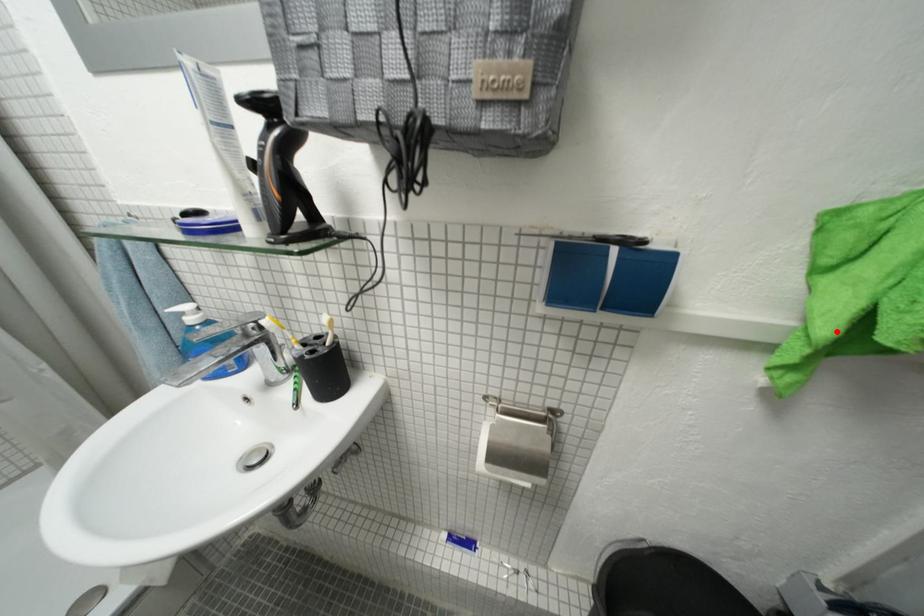
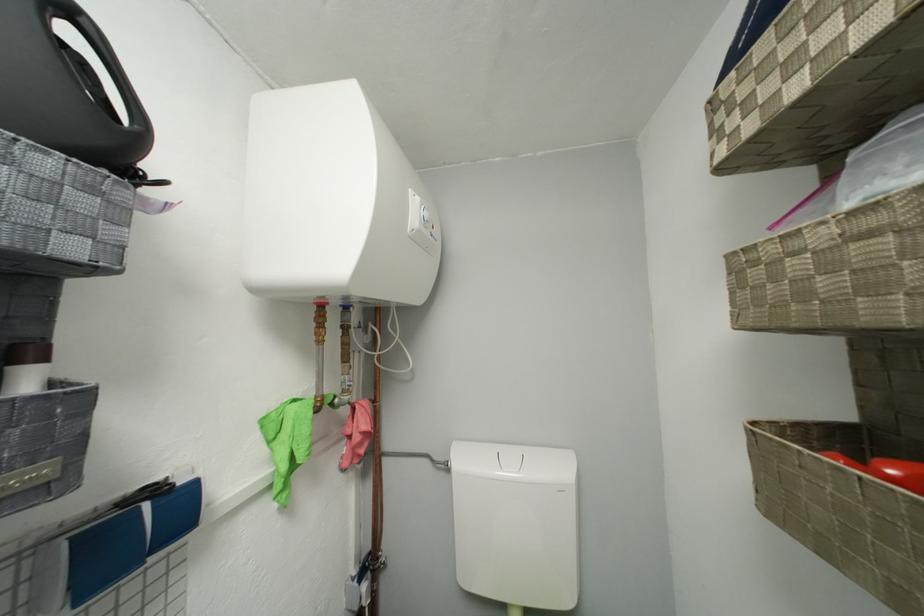
Find the pixel in the second image that matches the highlighted location in the first image.

(293, 469)